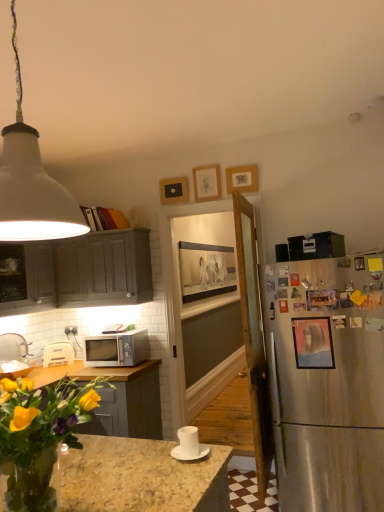
Question: Considering the relative sizes of matte pink picture frame at right, arranged as the fifth picture frame when viewed from the back, and white plastic toaster at lower left in the image provided, is matte pink picture frame at right, arranged as the fifth picture frame when viewed from the back, taller than white plastic toaster at lower left?

Choices:
 (A) yes
 (B) no

Answer: (A)

Question: From a real-world perspective, is matte pink picture frame at right, arranged as the fifth picture frame when viewed from the back, on top of white plastic toaster at lower left?

Choices:
 (A) no
 (B) yes

Answer: (B)

Question: Is matte pink picture frame at right, marked as the 2th picture frame in a front-to-back arrangement, positioned far away from white plastic toaster at lower left?

Choices:
 (A) yes
 (B) no

Answer: (A)

Question: Is matte pink picture frame at right, arranged as the fifth picture frame when viewed from the back, facing away from white plastic toaster at lower left?

Choices:
 (A) yes
 (B) no

Answer: (B)

Question: From the image's perspective, would you say matte pink picture frame at right, arranged as the fifth picture frame when viewed from the back, is shown under white plastic toaster at lower left?

Choices:
 (A) no
 (B) yes

Answer: (A)

Question: Do you think wooden picture frame at right, acting as the 6th picture frame starting from the back, is within satin silver microwave at lower left, or outside of it?

Choices:
 (A) outside
 (B) inside

Answer: (A)

Question: Is wooden picture frame at right, acting as the 6th picture frame starting from the back, bigger or smaller than satin silver microwave at lower left?

Choices:
 (A) small
 (B) big

Answer: (A)

Question: Considering the positions of wooden picture frame at right, marked as the first picture frame in a front-to-back arrangement, and satin silver microwave at lower left in the image, is wooden picture frame at right, marked as the first picture frame in a front-to-back arrangement, wider or thinner than satin silver microwave at lower left?

Choices:
 (A) wide
 (B) thin

Answer: (B)

Question: Considering the positions of point (317, 305) and point (91, 355), is point (317, 305) closer or farther from the camera than point (91, 355)?

Choices:
 (A) farther
 (B) closer

Answer: (B)

Question: Considering their positions, is wooden picture frame at upper center, arranged as the 4th picture frame when viewed from the back, located in front of or behind matte gray cabinet at left, which appears as the second cabinetry when viewed from the right?

Choices:
 (A) behind
 (B) front

Answer: (A)

Question: From the image's perspective, relative to matte gray cabinet at left, the first cabinetry from the left, is wooden picture frame at upper center, which is counted as the 3th picture frame, starting from the front, above or below?

Choices:
 (A) above
 (B) below

Answer: (A)

Question: Is wooden picture frame at upper center, arranged as the 4th picture frame when viewed from the back, wider or thinner than matte gray cabinet at left, the first cabinetry from the left?

Choices:
 (A) thin
 (B) wide

Answer: (A)

Question: From a real-world perspective, is wooden picture frame at upper center, arranged as the 4th picture frame when viewed from the back, physically located above or below matte gray cabinet at left, which appears as the second cabinetry when viewed from the right?

Choices:
 (A) above
 (B) below

Answer: (A)

Question: From the image's perspective, is translucent glass vase at lower left located above or below wooden picture frame at right, marked as the first picture frame in a front-to-back arrangement?

Choices:
 (A) above
 (B) below

Answer: (B)

Question: Considering the positions of point (49, 412) and point (317, 291), is point (49, 412) closer or farther from the camera than point (317, 291)?

Choices:
 (A) farther
 (B) closer

Answer: (B)